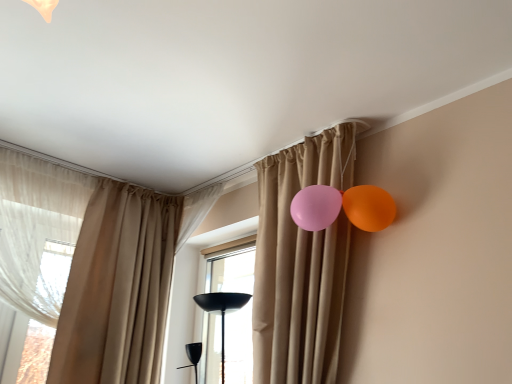
This screenshot has width=512, height=384. What do you see at coordinates (37, 230) in the screenshot? I see `sheer white curtain at left, the first curtain in the left-to-right sequence` at bounding box center [37, 230].

What do you see at coordinates (231, 270) in the screenshot?
I see `transparent glass window at center` at bounding box center [231, 270].

This screenshot has height=384, width=512. Identify the location of transparent glass window at center. (231, 270).

Describe the element at coordinates (369, 207) in the screenshot. The image size is (512, 384). I see `orange matte balloon at upper right` at that location.

Where is `matte beige curtain at upper center, which ranks as the first curtain in right-to-left order`? matte beige curtain at upper center, which ranks as the first curtain in right-to-left order is located at coordinates (301, 263).

Where is `sheer white curtain at left, the first curtain in the left-to-right sequence`? This screenshot has width=512, height=384. sheer white curtain at left, the first curtain in the left-to-right sequence is located at coordinates (37, 230).

Is orange matte balloon at upper right located within beige fabric curtain at center, which is the second curtain from right to left?

No, orange matte balloon at upper right is not a part of beige fabric curtain at center, which is the second curtain from right to left.

Between beige fabric curtain at center, which is the second curtain from right to left, and orange matte balloon at upper right, which one has more height?

beige fabric curtain at center, which is the second curtain from right to left, is taller.

What are the coordinates of `curtain that is the 2nd one when counting forward from the beige fabric curtain at center, which is the second curtain from right to left` in the screenshot? It's located at 37,230.

From their relative heights in the image, would you say beige fabric curtain at center, which is the second curtain from right to left, is taller or shorter than sheer white curtain at left, the 4th curtain viewed from the right?

In the image, beige fabric curtain at center, which is the second curtain from right to left, appears to be shorter than sheer white curtain at left, the 4th curtain viewed from the right.

From the image's perspective, is beige fabric curtain at center, which ranks as the 3th curtain in left-to-right order, above sheer white curtain at left, the first curtain in the left-to-right sequence?

Indeed, from the image's perspective, beige fabric curtain at center, which ranks as the 3th curtain in left-to-right order, is shown above sheer white curtain at left, the first curtain in the left-to-right sequence.

Is orange matte balloon at upper right facing towards sheer white curtain at left, the 4th curtain viewed from the right?

No.

From the image's perspective, is orange matte balloon at upper right located above sheer white curtain at left, the 4th curtain viewed from the right?

Correct, orange matte balloon at upper right appears higher than sheer white curtain at left, the 4th curtain viewed from the right, in the image.

Is point (388, 196) more distant than point (12, 245)?

No, (388, 196) is closer to viewer.

Is orange matte balloon at upper right touching sheer white curtain at left, the 4th curtain viewed from the right?

No, orange matte balloon at upper right is not with sheer white curtain at left, the 4th curtain viewed from the right.

Would you say matte beige curtain at upper center, which ranks as the first curtain in right-to-left order, is outside sheer white curtain at left, the 4th curtain viewed from the right?

Yes, matte beige curtain at upper center, which ranks as the first curtain in right-to-left order, is located beyond the bounds of sheer white curtain at left, the 4th curtain viewed from the right.

Is matte beige curtain at upper center, the 4th curtain in the left-to-right sequence, behind sheer white curtain at left, the 4th curtain viewed from the right?

No, it is not.

Is matte beige curtain at upper center, which ranks as the first curtain in right-to-left order, shorter than sheer white curtain at left, the first curtain in the left-to-right sequence?

No, matte beige curtain at upper center, which ranks as the first curtain in right-to-left order, is not shorter than sheer white curtain at left, the first curtain in the left-to-right sequence.

From a real-world perspective, is matte beige curtain at upper center, which ranks as the first curtain in right-to-left order, positioned under sheer white curtain at left, the 4th curtain viewed from the right, based on gravity?

Correct, in the physical world, matte beige curtain at upper center, which ranks as the first curtain in right-to-left order, is lower than sheer white curtain at left, the 4th curtain viewed from the right.

Can you confirm if transparent glass window at center is wider than beige fabric curtain at center, which ranks as the 3th curtain in left-to-right order?

No.

Is transparent glass window at center positioned with its back to beige fabric curtain at center, which is the second curtain from right to left?

That's not correct — transparent glass window at center is not looking away from beige fabric curtain at center, which is the second curtain from right to left.

Is transparent glass window at center bigger than beige fabric curtain at center, which is the second curtain from right to left?

Correct, transparent glass window at center is larger in size than beige fabric curtain at center, which is the second curtain from right to left.

Is transparent glass window at center positioned in front of beige fabric curtain at center, which ranks as the 3th curtain in left-to-right order?

Yes, transparent glass window at center is closer to the viewer.

Can you tell me how much sheer white curtain at left, the 4th curtain viewed from the right, and beige fabric curtain at center, which is the second curtain from right to left, differ in facing direction?

88.5 degrees.

Which is more to the left, sheer white curtain at left, the 4th curtain viewed from the right, or beige fabric curtain at center, which ranks as the 3th curtain in left-to-right order?

From the viewer's perspective, sheer white curtain at left, the 4th curtain viewed from the right, appears more on the left side.

Does sheer white curtain at left, the first curtain in the left-to-right sequence, have a lesser height compared to beige fabric curtain at center, which ranks as the 3th curtain in left-to-right order?

In fact, sheer white curtain at left, the first curtain in the left-to-right sequence, may be taller than beige fabric curtain at center, which ranks as the 3th curtain in left-to-right order.

From a real-world perspective, between sheer white curtain at left, the first curtain in the left-to-right sequence, and beige fabric curtain at center, which ranks as the 3th curtain in left-to-right order, who is vertically higher?

beige fabric curtain at center, which ranks as the 3th curtain in left-to-right order, from a real-world perspective.

Looking at this image, from the image's perspective, which is above, sheer white curtain at left, the 4th curtain viewed from the right, or orange matte balloon at upper right?

orange matte balloon at upper right appears higher in the image.

Which is in front, sheer white curtain at left, the first curtain in the left-to-right sequence, or orange matte balloon at upper right?

orange matte balloon at upper right is in front.

In the scene shown: Is sheer white curtain at left, the 4th curtain viewed from the right, surrounding orange matte balloon at upper right?

Definitely not — orange matte balloon at upper right is not inside sheer white curtain at left, the 4th curtain viewed from the right.

Considering the sizes of objects sheer white curtain at left, the first curtain in the left-to-right sequence, and orange matte balloon at upper right in the image provided, who is shorter, sheer white curtain at left, the first curtain in the left-to-right sequence, or orange matte balloon at upper right?

orange matte balloon at upper right.

Find the location of a particular element. This screenshot has height=384, width=512. curtain above the orange matte balloon at upper right (from a real-world perspective) is located at coordinates (196, 211).

Identify the location of the 2nd curtain behind the sheer white curtain at left, the 4th curtain viewed from the right, starting your count from the anchor. (196, 211).

Which object lies nearer to the anchor point beige fabric curtain at left, which is the 3th curtain in right-to-left order, transparent glass window at center or matte beige curtain at upper center, which ranks as the first curtain in right-to-left order?

Based on the image, transparent glass window at center appears to be nearer to beige fabric curtain at left, which is the 3th curtain in right-to-left order.

Looking at the image, which one is located closer to beige fabric curtain at center, which is the second curtain from right to left, beige fabric curtain at left, which is the 3th curtain in right-to-left order, or orange matte balloon at upper right?

The object closer to beige fabric curtain at center, which is the second curtain from right to left, is beige fabric curtain at left, which is the 3th curtain in right-to-left order.

Based on their spatial positions, is transparent glass window at center or beige fabric curtain at left, the 2th curtain positioned from the left, further from sheer white curtain at left, the 4th curtain viewed from the right?

transparent glass window at center is further to sheer white curtain at left, the 4th curtain viewed from the right.

From the picture: Based on their spatial positions, is orange matte balloon at upper right or beige fabric curtain at center, which is the second curtain from right to left, further from transparent glass window at center?

Based on the image, orange matte balloon at upper right appears to be further to transparent glass window at center.

Which object lies nearer to the anchor point orange matte balloon at upper right, beige fabric curtain at left, the 2th curtain positioned from the left, or matte beige curtain at upper center, the 4th curtain in the left-to-right sequence?

Based on the image, matte beige curtain at upper center, the 4th curtain in the left-to-right sequence, appears to be nearer to orange matte balloon at upper right.

When comparing their distances from orange matte balloon at upper right, does sheer white curtain at left, the first curtain in the left-to-right sequence, or matte beige curtain at upper center, the 4th curtain in the left-to-right sequence, seem further?

sheer white curtain at left, the first curtain in the left-to-right sequence, is positioned further to the anchor orange matte balloon at upper right.

Looking at the image, which one is located closer to matte beige curtain at upper center, the 4th curtain in the left-to-right sequence, sheer white curtain at left, the 4th curtain viewed from the right, or beige fabric curtain at left, the 2th curtain positioned from the left?

The object closer to matte beige curtain at upper center, the 4th curtain in the left-to-right sequence, is beige fabric curtain at left, the 2th curtain positioned from the left.

Which object lies nearer to the anchor point beige fabric curtain at left, the 2th curtain positioned from the left, beige fabric curtain at center, which is the second curtain from right to left, or transparent glass window at center?

beige fabric curtain at center, which is the second curtain from right to left.

You are a GUI agent. You are given a task and a screenshot of the screen. Output one action in this format:
    pyautogui.click(x=<x>, y=<y>)
    Task: Click on the window between beige fabric curtain at left, the 2th curtain positioned from the left, and matte beige curtain at upper center, which ranks as the first curtain in right-to-left order, from left to right
    
    Given the screenshot: What is the action you would take?
    pyautogui.click(x=231, y=270)

I want to click on window between matte beige curtain at upper center, the 4th curtain in the left-to-right sequence, and beige fabric curtain at center, which is the second curtain from right to left, from front to back, so click(231, 270).

The image size is (512, 384). I want to click on window situated between beige fabric curtain at left, the 2th curtain positioned from the left, and orange matte balloon at upper right from left to right, so click(x=231, y=270).

Identify the location of window between sheer white curtain at left, the first curtain in the left-to-right sequence, and orange matte balloon at upper right from left to right. The image size is (512, 384). (231, 270).